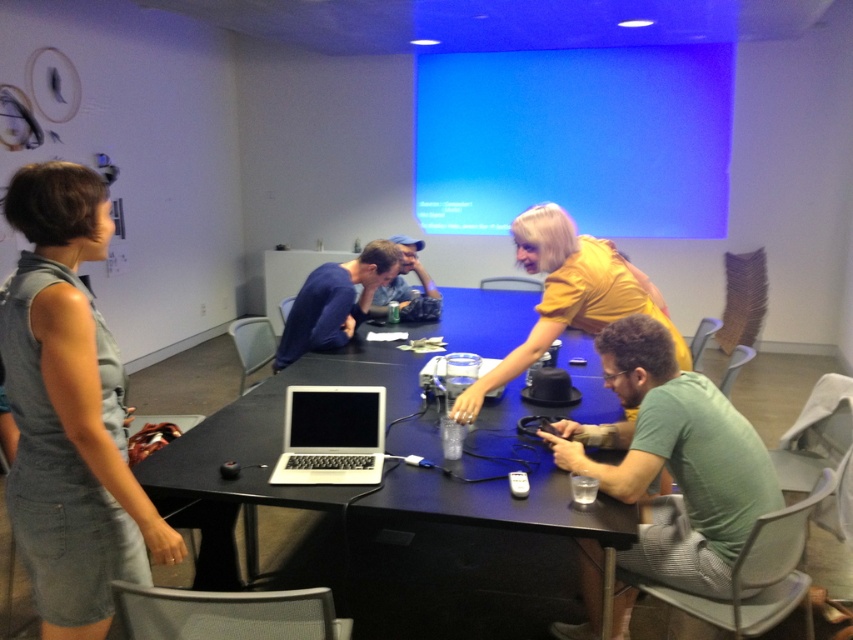
Question: Which object is farther from the camera taking this photo?

Choices:
 (A) denim dress at left
 (B) black plastic table at center
 (C) dark blue fabric shirt at center
 (D) clear plastic projector at center

Answer: (C)

Question: Is blue matte projection screen at upper center to the left of dark blue fabric shirt at center from the viewer's perspective?

Choices:
 (A) no
 (B) yes

Answer: (A)

Question: Does blue matte projection screen at upper center appear on the right side of dark blue fabric shirt at center?

Choices:
 (A) no
 (B) yes

Answer: (B)

Question: Which point is farther from the camera taking this photo?

Choices:
 (A) (698, 68)
 (B) (289, 445)
 (C) (592, 253)
 (D) (383, 300)

Answer: (A)

Question: Which object is the farthest from the black plastic table at center?

Choices:
 (A) denim jacket at center
 (B) denim dress at left
 (C) green matte shirt at lower right

Answer: (A)

Question: Can you confirm if black plastic table at center is positioned to the left of green matte shirt at lower right?

Choices:
 (A) yes
 (B) no

Answer: (A)